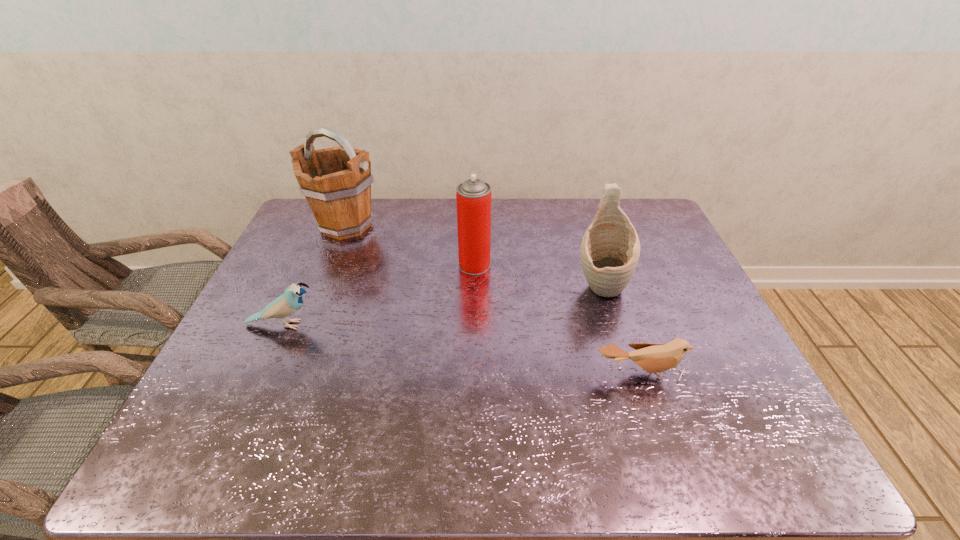
Locate an element on the screen. The image size is (960, 540). free location at the right edge is located at coordinates (682, 307).

Identify the location of free spot at the near left corner of the desktop. (191, 446).

In the image, there is a desktop. What are the coordinates of `vacant space at the far right corner` in the screenshot? It's located at (639, 233).

Where is `vacant space that's between the pitcher and the second shortest object`? vacant space that's between the pitcher and the second shortest object is located at coordinates (442, 306).

I want to click on empty location between the aerosol can and the pitcher, so click(x=538, y=275).

The image size is (960, 540). Find the location of `vacant space that's between the fourth tallest object and the pitcher`. vacant space that's between the fourth tallest object and the pitcher is located at coordinates (442, 306).

Locate an element on the screen. vacant space in between the taller bird and the bucket is located at coordinates (315, 275).

This screenshot has width=960, height=540. In order to click on free space between the taller bird and the aerosol can in this screenshot , I will do `click(379, 295)`.

Image resolution: width=960 pixels, height=540 pixels. What are the coordinates of `free space between the fourth tallest object and the pitcher` in the screenshot? It's located at (442, 306).

Locate an element on the screen. The image size is (960, 540). free point between the fourth tallest object and the aerosol can is located at coordinates (379, 295).